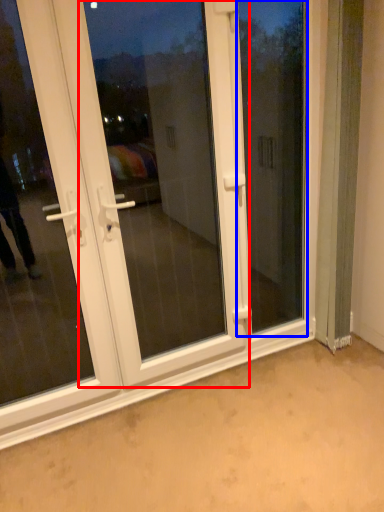
Question: Which of the following is the closest to the observer, screen door (highlighted by a red box) or window screen (highlighted by a blue box)?

Choices:
 (A) screen door
 (B) window screen

Answer: (A)